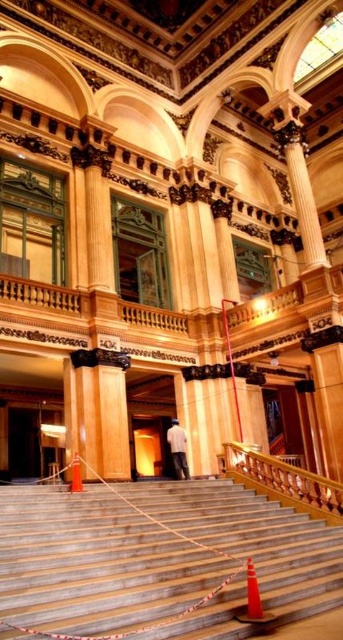
Consider the image. You are standing at the base of the staircase in the grand building and notice two points marked in the scene. The first point is at coordinates point (308,493), and the second is at point (176,444). Which of these two points is nearer to your current position?

Point (308,493) is closer to the camera than point (176,444), so the first point is nearer to your current position.